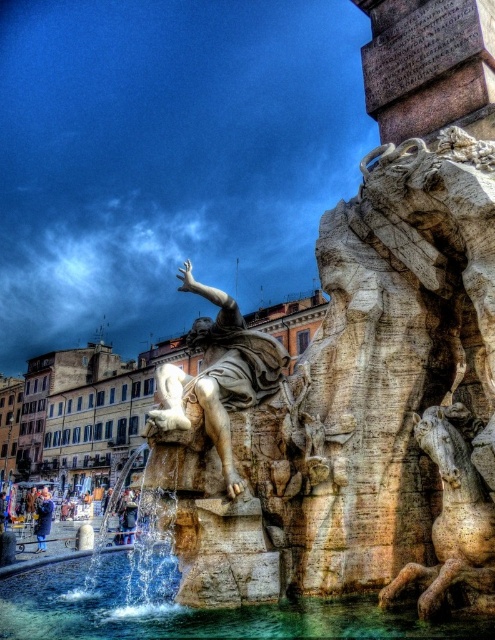
Question: Considering the relative positions of stone statue at center and carved stone horse at center in the image provided, where is stone statue at center located with respect to carved stone horse at center?

Choices:
 (A) left
 (B) right

Answer: (A)

Question: Which point appears closest to the camera in this image?

Choices:
 (A) (407, 577)
 (B) (244, 344)
 (C) (347, 625)
 (D) (38, 168)

Answer: (C)

Question: Which is farther from the blue wool coat at lower left?

Choices:
 (A) stone statue at center
 (B) carved stone horse at center
 (C) white marble statue at center

Answer: (A)

Question: Considering the relative positions of carved stone horse at center and blue wool coat at lower left in the image provided, where is carved stone horse at center located with respect to blue wool coat at lower left?

Choices:
 (A) left
 (B) right

Answer: (B)

Question: Is stone statue at center closer to camera compared to carved stone horse at center?

Choices:
 (A) yes
 (B) no

Answer: (B)

Question: Among these objects, which one is farthest from the camera?

Choices:
 (A) clear water at fountain center
 (B) stone statue at center
 (C) blue wool coat at lower left
 (D) white marble statue at center

Answer: (B)